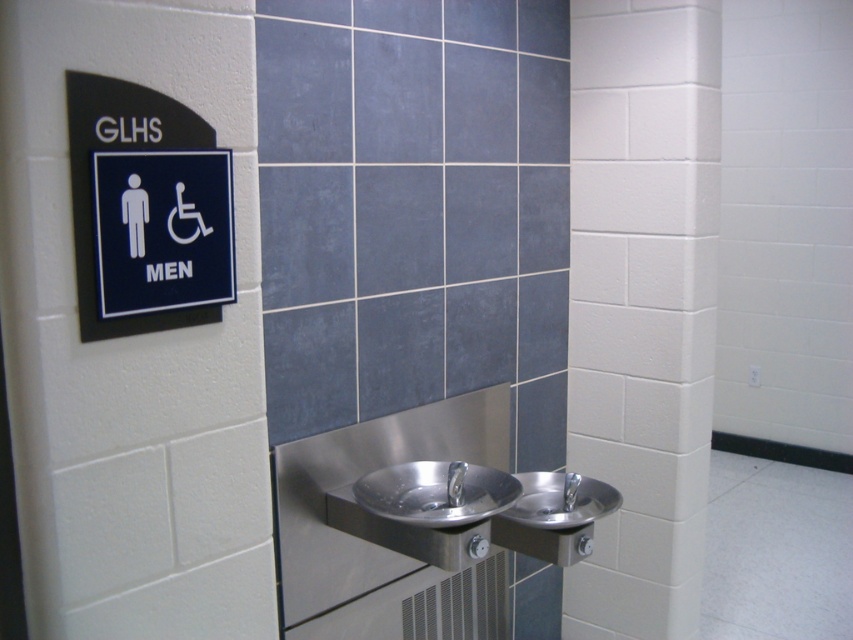
Question: Based on their relative distances, which object is farther from the stainless steel sink at center?

Choices:
 (A) polished stainless steel sink at center
 (B) black plastic sign at upper left

Answer: (B)

Question: Is black plastic sign at upper left below stainless steel sink at center?

Choices:
 (A) no
 (B) yes

Answer: (A)

Question: Which object is positioned closest to the stainless steel sink at center?

Choices:
 (A) polished stainless steel sink at center
 (B) black plastic sign at upper left

Answer: (A)

Question: Does black plastic sign at upper left appear on the right side of stainless steel sink at center?

Choices:
 (A) yes
 (B) no

Answer: (B)

Question: In this image, where is black plastic sign at upper left located relative to polished stainless steel sink at center?

Choices:
 (A) right
 (B) left

Answer: (B)

Question: Among these points, which one is farthest from the camera?

Choices:
 (A) (583, 493)
 (B) (225, 268)

Answer: (A)